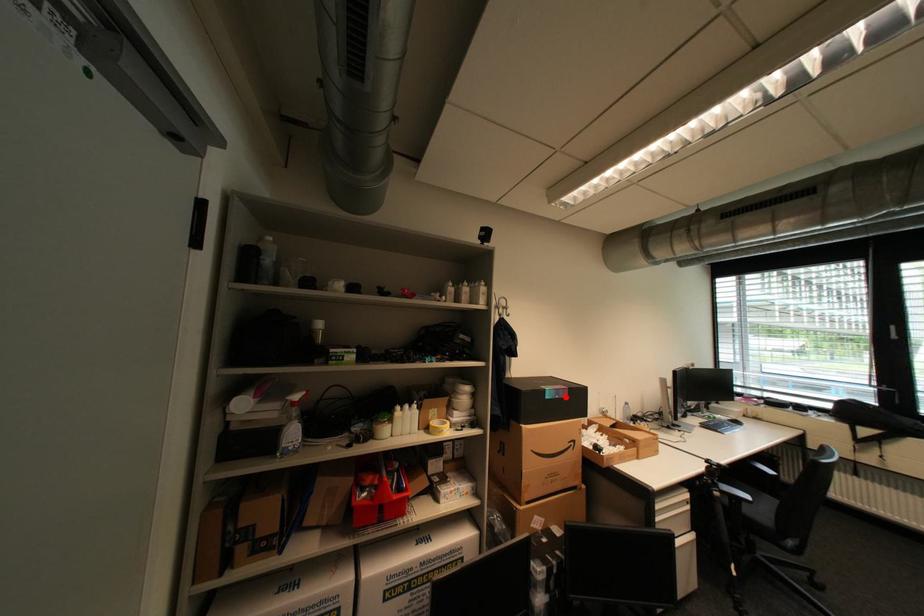
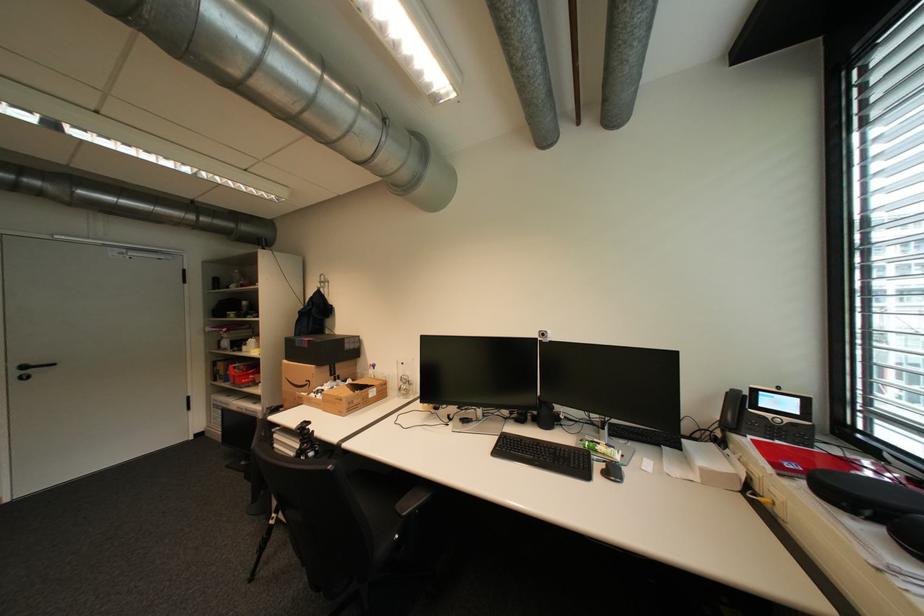
In the second image, find the point that corresponds to the highlighted location in the first image.

(310, 346)